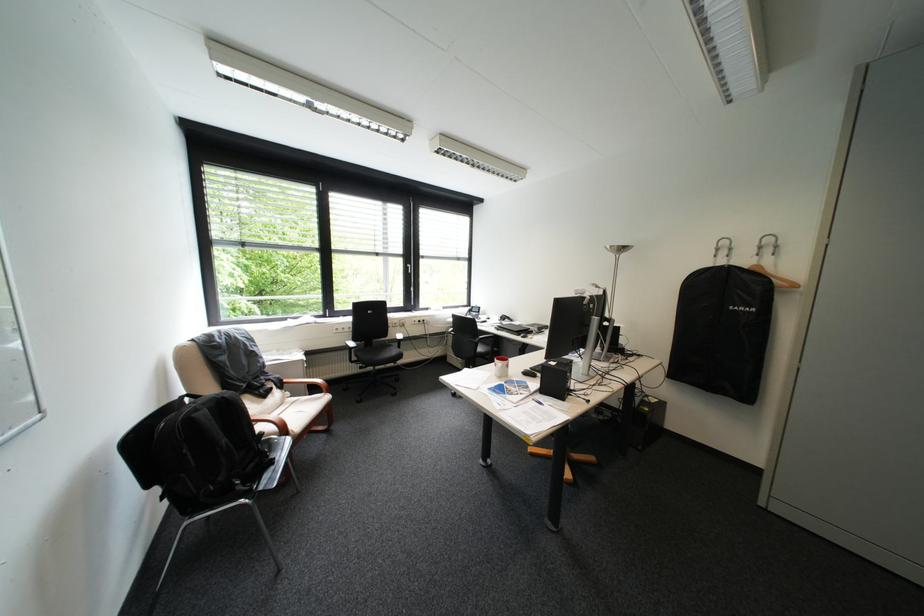
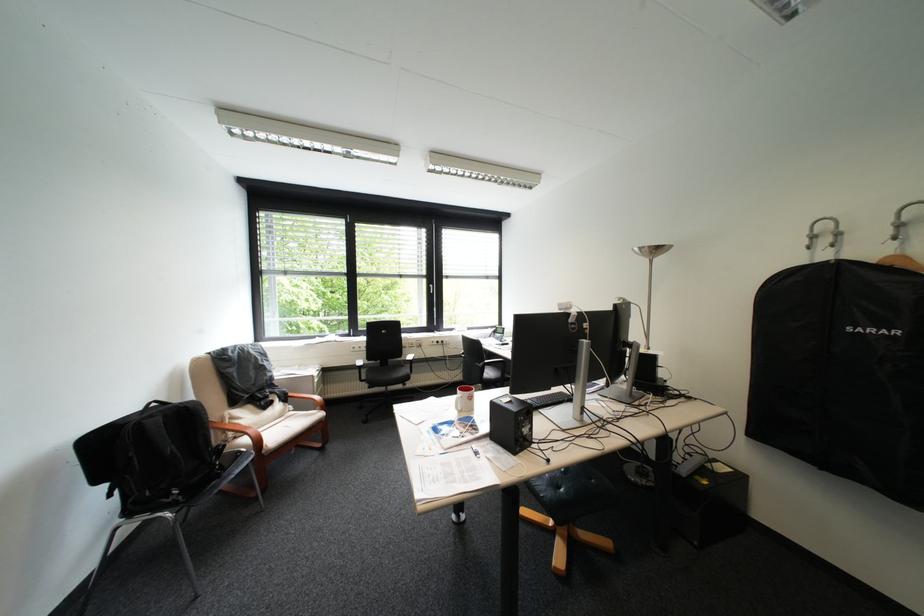
The point at (x=236, y=398) is marked in the first image. Where is the corresponding point in the second image?

(199, 407)